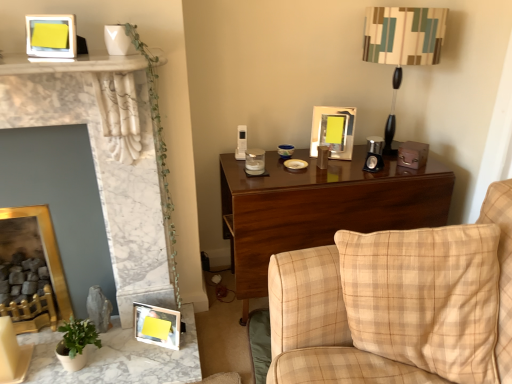
In order to click on empty space that is ontop of marble table at lower left in this screenshot , I will do `click(104, 355)`.